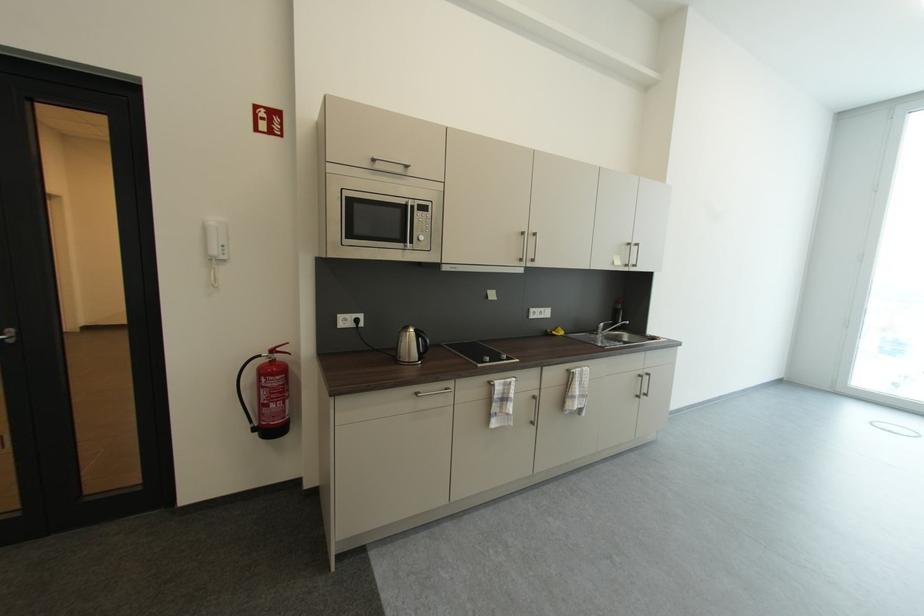
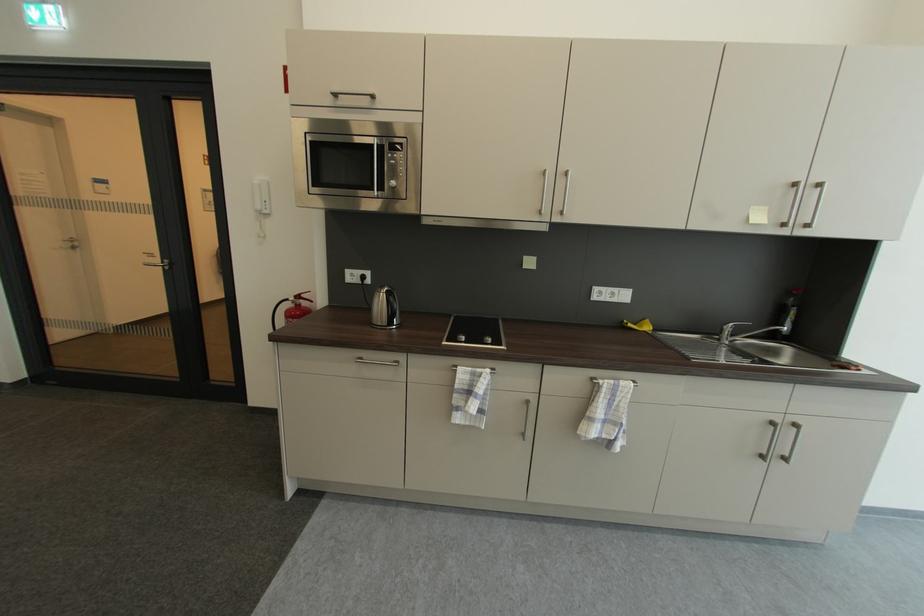
The point at (221, 254) is marked in the first image. Where is the corresponding point in the second image?

(264, 208)